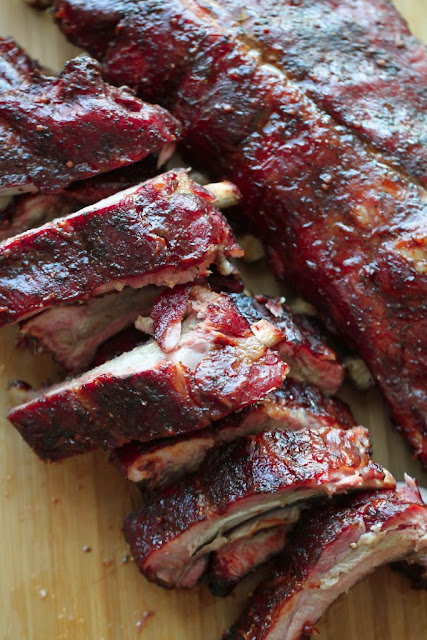
Locate an element on the screen. liquid on cutting board is located at coordinates (35, 612), (71, 580), (85, 525), (107, 490), (152, 594), (185, 601).